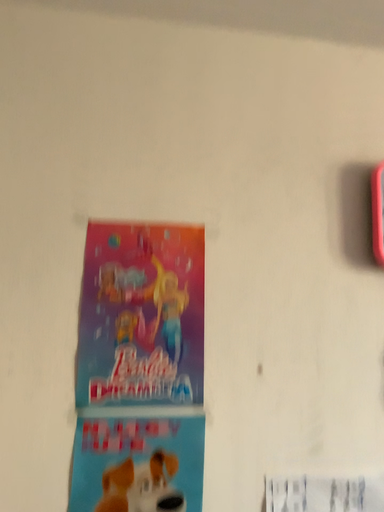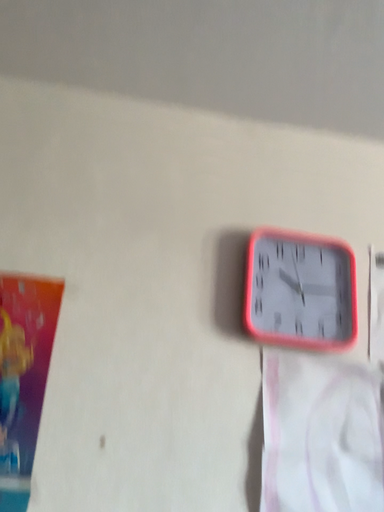
Question: How did the camera likely rotate when shooting the video?

Choices:
 (A) rotated downward
 (B) rotated upward

Answer: (B)